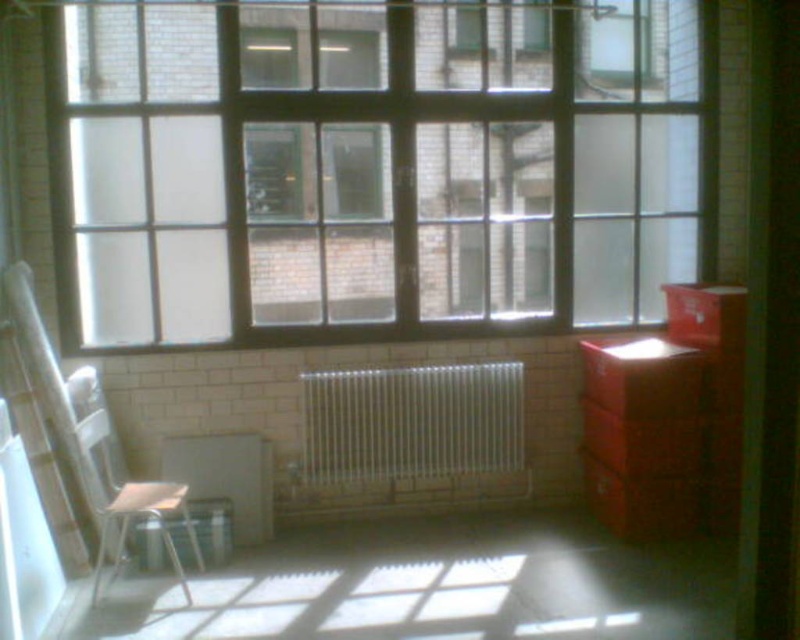
Question: Is clear glass window at center bigger than white plastic chair at left?

Choices:
 (A) no
 (B) yes

Answer: (B)

Question: In this image, where is clear glass window at center located relative to metallic silver stool at lower left?

Choices:
 (A) above
 (B) below

Answer: (A)

Question: Which of the following is the farthest from the observer?

Choices:
 (A) (173, 561)
 (B) (214, 516)
 (C) (380, 392)
 (D) (572, 161)

Answer: (D)

Question: Considering the relative positions of white plastic chair at left and metallic silver stool at lower left in the image provided, where is white plastic chair at left located with respect to metallic silver stool at lower left?

Choices:
 (A) below
 (B) above

Answer: (B)

Question: Which object is the farthest from the clear glass window at center?

Choices:
 (A) white metallic radiator at center
 (B) white plastic chair at left

Answer: (B)

Question: Among these points, which one is nearest to the camera?

Choices:
 (A) (306, 77)
 (B) (326, 433)
 (C) (136, 548)
 (D) (96, 388)

Answer: (C)